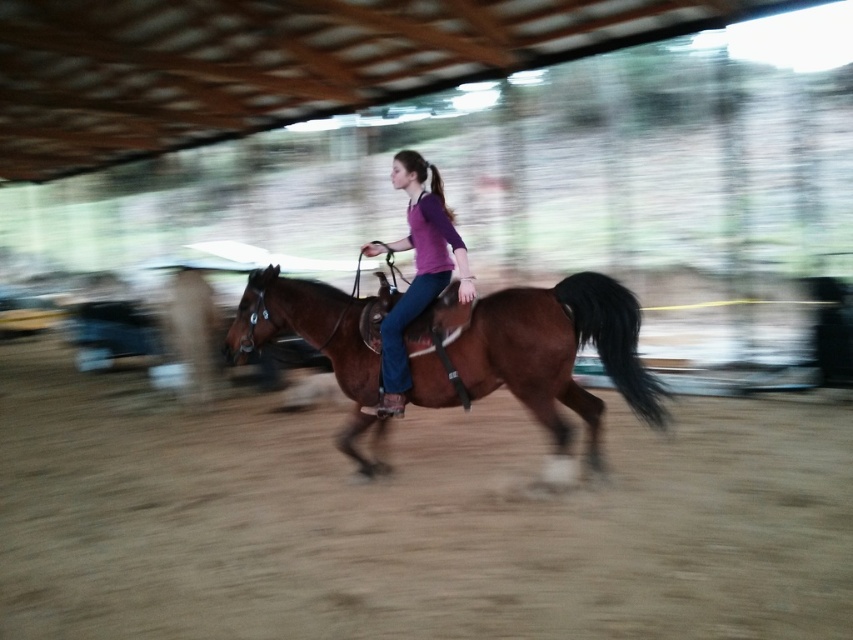
You are a photographer positioned at the entrance of the arena. You want to capture a photo where the brown sandy dirt track at center is clearly visible behind the brown leather horse at center. Is this possible based on their current positions?

The brown sandy dirt track at center is in front of the brown leather horse at center, so it cannot be seen behind the horse. You would need to adjust the horse and track positions to achieve this effect.

You are a photographer standing at the edge of the arena. You want to capture a photo of the brown leather horse at center and the purple matte shirt at center in the same frame. Given that your camera has a minimum focus distance of 20 inches, will both subjects be in focus?

The brown leather horse at center and purple matte shirt at center are 20.91 inches apart. Since the distance between them is greater than the camera minimum focus distance of 20 inches, both subjects will be in focus.

You are a photographer positioned at the front of the arena. You want to capture a photo that includes both point A at point (198, 474) and point B at point (426, 189). Which point should you focus on first to ensure both are in sharp focus?

Point A at point (198, 474) is further to the camera than point B at point (426, 189). To ensure both are in focus, focus on point A first since it is closer to the camera, allowing the depth of field to cover point B behind it.